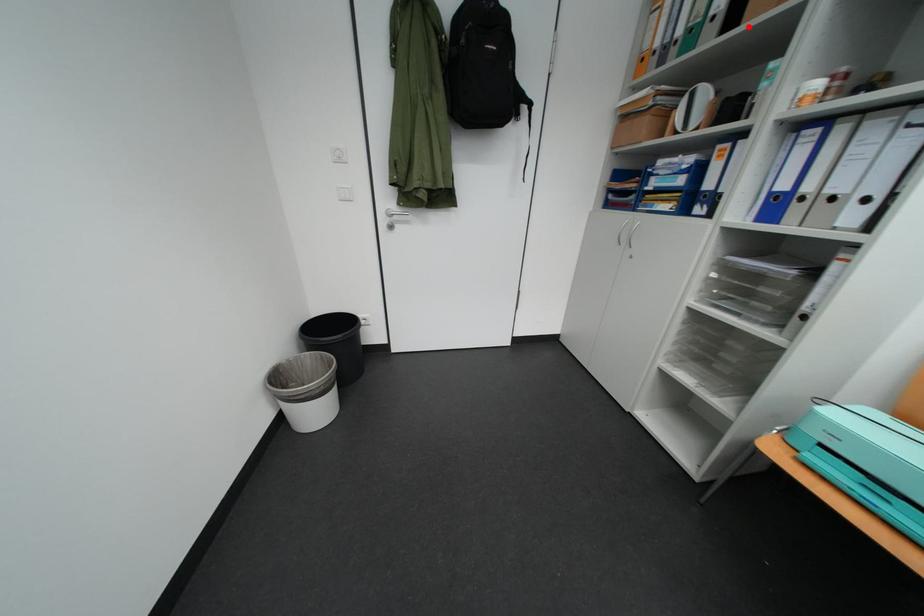
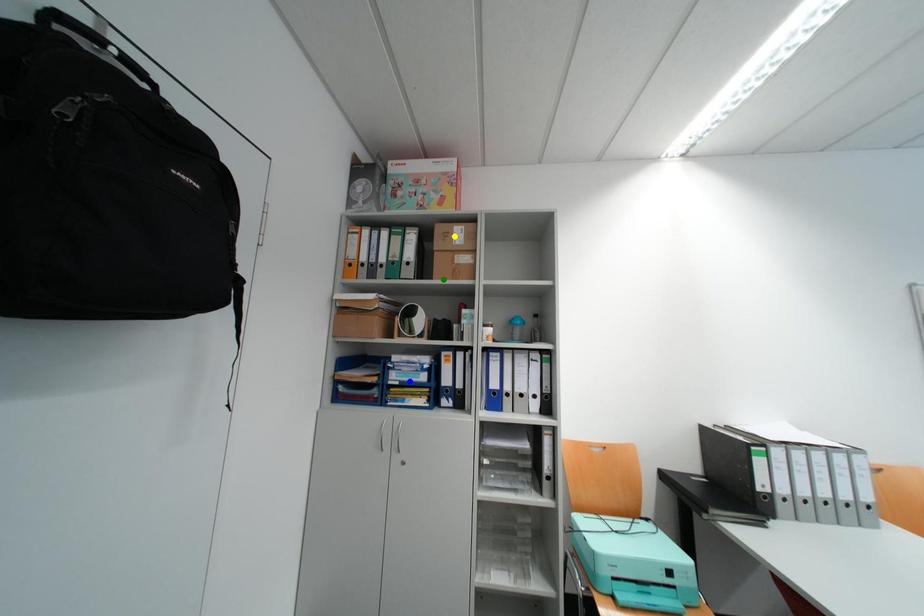
Question: I am providing you with two images of the same scene from different viewpoints. A red point is marked on the first image. You are given multiple points on the second image. Which point in image 2 is actually the same real-world point as the red point in image 1?

Choices:
 (A) yellow point
 (B) green point
 (C) blue point

Answer: (B)